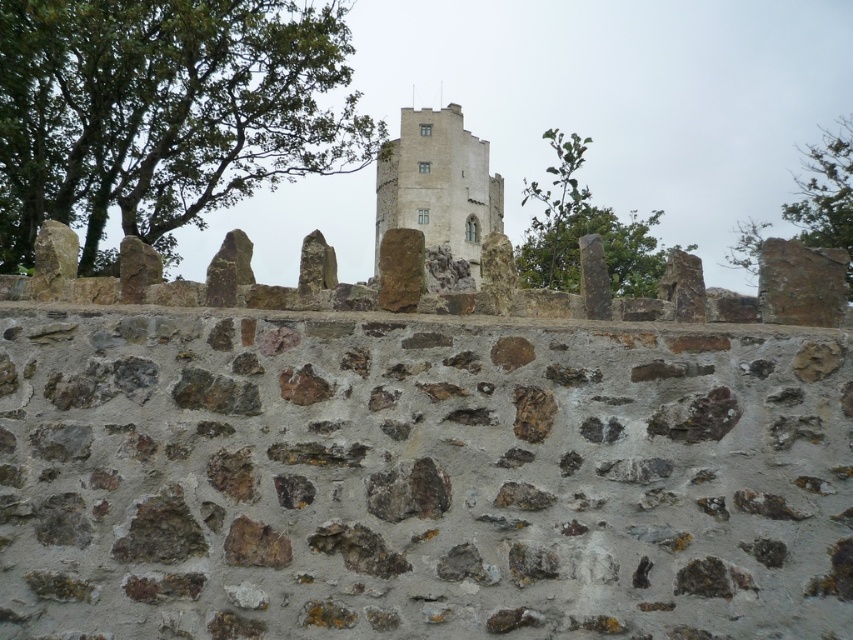
Where is `stone tower at center`? Image resolution: width=853 pixels, height=640 pixels. stone tower at center is located at coordinates (438, 184).

Can you confirm if stone tower at center is positioned to the right of green leafy tree at upper right?

In fact, stone tower at center is to the left of green leafy tree at upper right.

Locate an element on the screen. The width and height of the screenshot is (853, 640). stone tower at center is located at coordinates pyautogui.click(x=438, y=184).

Where is `stone tower at center`? This screenshot has height=640, width=853. stone tower at center is located at coordinates (438, 184).

Does stone tower at center appear under green leafy tree at upper center?

Actually, stone tower at center is above green leafy tree at upper center.

What do you see at coordinates (438, 184) in the screenshot?
I see `stone tower at center` at bounding box center [438, 184].

Identify the location of stone tower at center. The width and height of the screenshot is (853, 640). (x=438, y=184).

Is green leafy tree at upper left closer to the viewer compared to green leafy tree at upper center?

No, green leafy tree at upper left is further to the viewer.

Which is behind, point (276, 80) or point (605, 252)?

The point (605, 252) is behind.

Find the location of `green leafy tree at upper left`. green leafy tree at upper left is located at coordinates (164, 113).